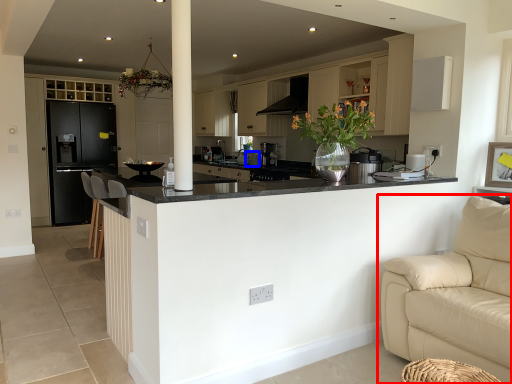
Question: Which of the following is the closest to the observer, studio couch (highlighted by a red box) or appliance (highlighted by a blue box)?

Choices:
 (A) studio couch
 (B) appliance

Answer: (A)